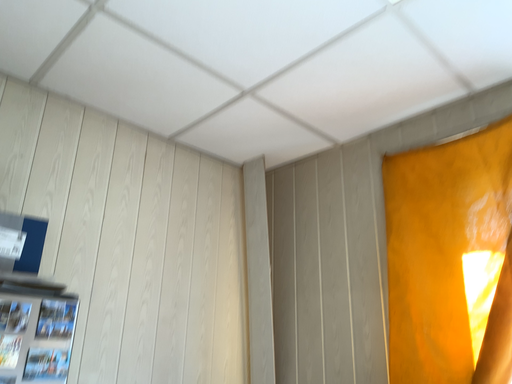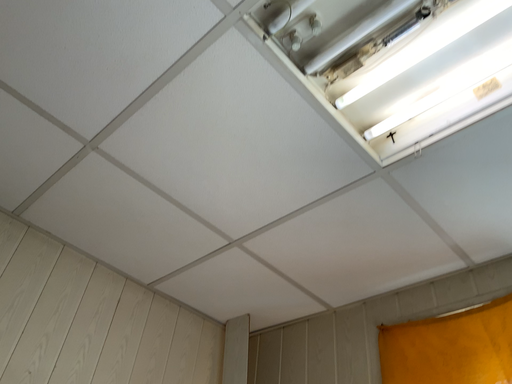
Question: How did the camera likely rotate when shooting the video?

Choices:
 (A) rotated downward
 (B) rotated upward

Answer: (B)